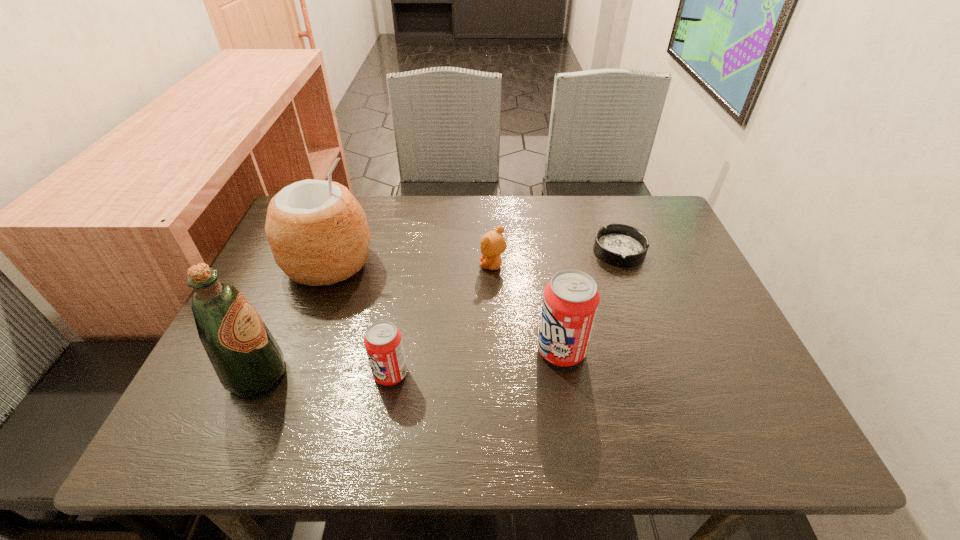
You are a GUI agent. You are given a task and a screenshot of the screen. Output one action in this format:
    pyautogui.click(x=<x>, y=<y>)
    Task: Click on the free location located 0.270m on the surface of the left soda can
    The width and height of the screenshot is (960, 540).
    Given the screenshot: What is the action you would take?
    pyautogui.click(x=242, y=374)

Locate an element on the screen. vacant space located on the surface of the left soda can is located at coordinates (296, 374).

At what (x,y) coordinates should I click in order to perform the action: click on free space located on the surface of the third tallest object. Please return your answer as a coordinate pair (x, y). This screenshot has width=960, height=540. Looking at the image, I should click on (486, 350).

The width and height of the screenshot is (960, 540). In order to click on free space located on the surface of the third tallest object in this screenshot , I will do `click(412, 350)`.

You are a GUI agent. You are given a task and a screenshot of the screen. Output one action in this format:
    pyautogui.click(x=<x>, y=<y>)
    Task: Click on the vacant region located 0.060m on the surface of the third tallest object
    The height and width of the screenshot is (540, 960).
    Given the screenshot: What is the action you would take?
    pyautogui.click(x=509, y=350)

This screenshot has height=540, width=960. In order to click on free location located on the face of the teddy bear in this screenshot , I will do `click(388, 266)`.

Find the location of `free space located 0.060m on the face of the teddy bear`. free space located 0.060m on the face of the teddy bear is located at coordinates (457, 266).

You are a GUI agent. You are given a task and a screenshot of the screen. Output one action in this format:
    pyautogui.click(x=<x>, y=<y>)
    Task: Click on the vacant space located 0.060m on the face of the teddy bear
    This screenshot has width=960, height=540.
    Given the screenshot: What is the action you would take?
    pyautogui.click(x=457, y=266)

At what (x,y) coordinates should I click in order to perform the action: click on free space located 0.110m on the right of the coconut. Please return your answer as a coordinate pair (x, y). Looking at the image, I should click on (417, 264).

Where is `free location located on the front of the rightmost object`? free location located on the front of the rightmost object is located at coordinates (636, 298).